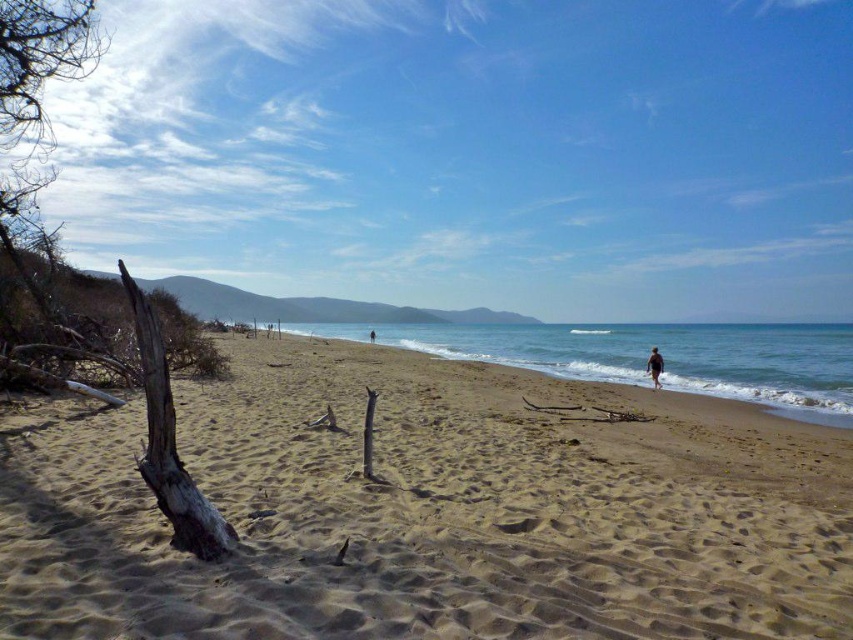
Question: Can you confirm if light brown sandy beach at center is positioned below brown sand at center?

Choices:
 (A) yes
 (B) no

Answer: (A)

Question: Which object is positioned closest to the dark brown skin at lower right?

Choices:
 (A) blue water at beach right
 (B) brown sand at center
 (C) light brown sandy beach at center

Answer: (C)

Question: Does light brown sandy beach at center have a larger size compared to brown sand at center?

Choices:
 (A) no
 (B) yes

Answer: (B)

Question: Is blue water at beach right bigger than brown sand at center?

Choices:
 (A) yes
 (B) no

Answer: (A)

Question: Which object appears farthest from the camera in this image?

Choices:
 (A) light brown sandy beach at center
 (B) blue water at beach right
 (C) brown sand at center
 (D) dark brown skin at lower right

Answer: (C)

Question: Which of the following is the farthest from the observer?

Choices:
 (A) (234, 412)
 (B) (375, 337)
 (C) (339, 326)
 (D) (660, 356)

Answer: (C)